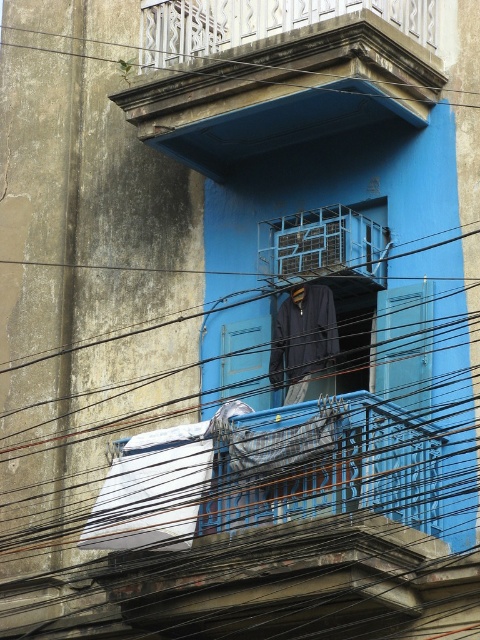
Question: Observing the image, what is the correct spatial positioning of blue metal railing at upper center in reference to black wire at upper center?

Choices:
 (A) above
 (B) below

Answer: (B)

Question: Which point is closer to the camera?

Choices:
 (A) (15, 45)
 (B) (384, 232)

Answer: (B)

Question: Can you confirm if blue metal railing at upper center is smaller than dark blue fabric at center?

Choices:
 (A) yes
 (B) no

Answer: (A)

Question: Among these objects, which one is farthest from the camera?

Choices:
 (A) black wire at upper center
 (B) blue metal railing at upper center
 (C) dark blue fabric at center

Answer: (A)

Question: Which of the following is the closest to the observer?

Choices:
 (A) (291, 316)
 (B) (352, 234)

Answer: (B)

Question: Is dark blue fabric at center smaller than black wire at upper center?

Choices:
 (A) no
 (B) yes

Answer: (B)